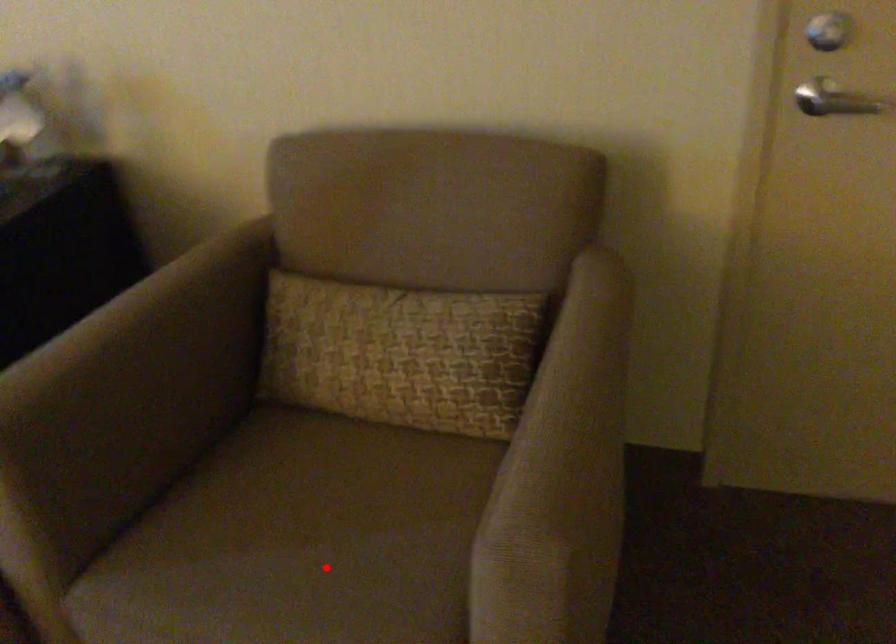
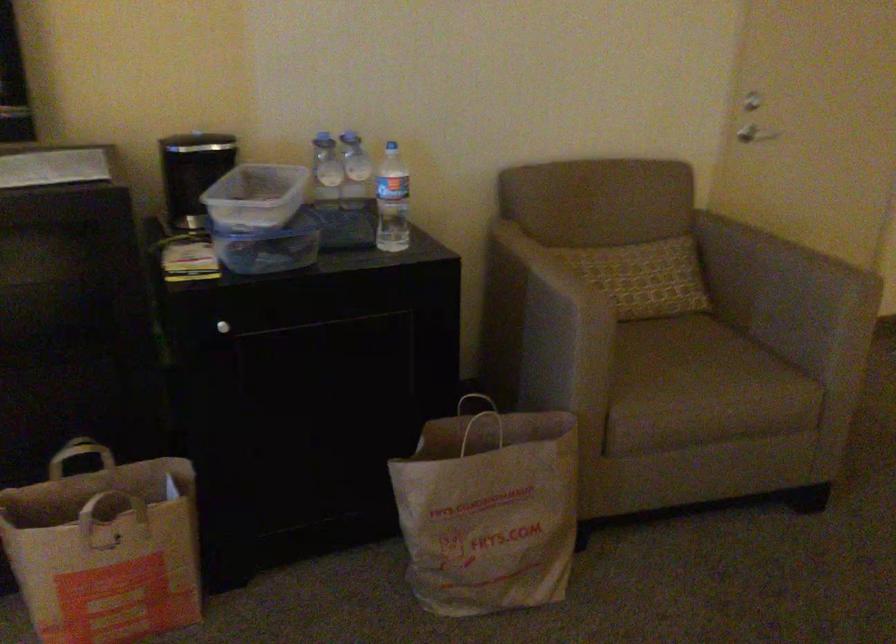
Question: I am providing you with two images of the same scene from different viewpoints. In image1, a red point is highlighted. Considering the same 3D point in image2, which of the following is correct?

Choices:
 (A) It is closer
 (B) It is farther

Answer: (B)